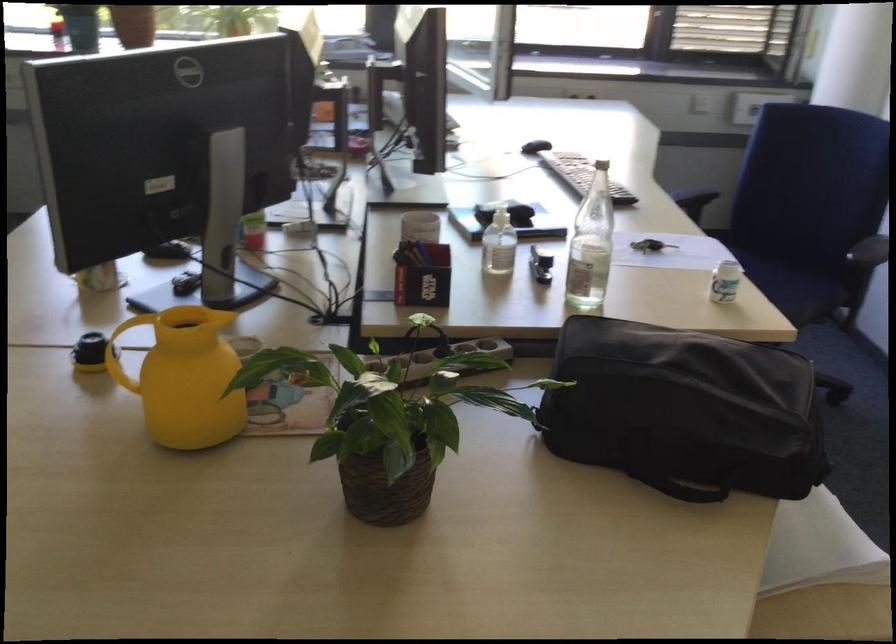
This screenshot has width=896, height=644. In order to click on black bag handle in this screenshot , I will do `click(694, 491)`.